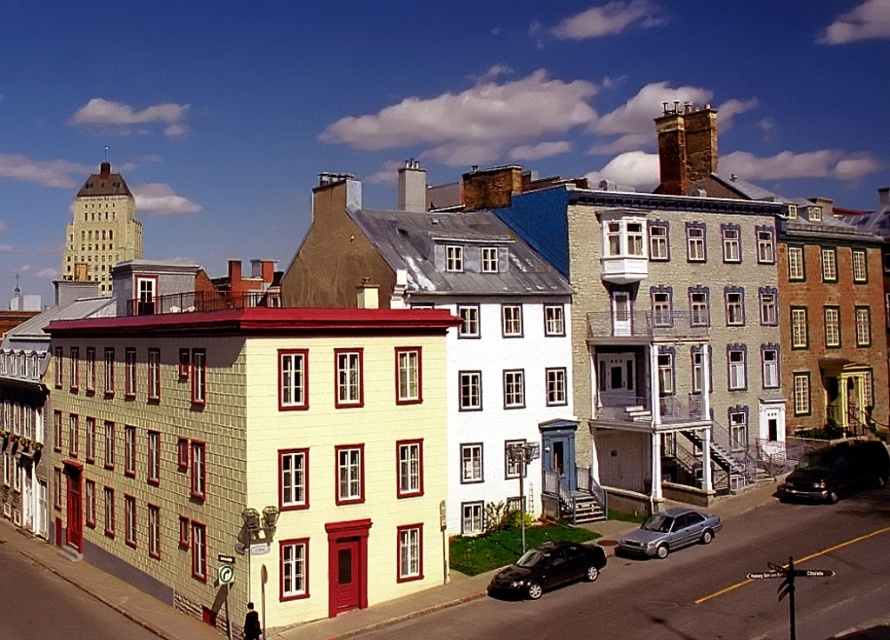
You are a pedestrian standing at the crosswalk in the middle of the street. You see a shiny black van at lower right and a metallic silver sedan at center. Which vehicle is positioned to the right of the other?

The shiny black van at lower right is to the right of the metallic silver sedan at center.

You are standing at the center of the street looking forward. There is a shiny black van at lower right. Where is the shiny black van located in relation to the point at coordinates (x=836, y=472)?

The shiny black van at lower right is located at point (x=836, y=472).

You are a pedestrian standing at the crosswalk on the sidewalk. You need to cross the street to reach the light beige or cream building with red trim on the left. Which direction should you walk to avoid the shiny black sedan at lower center and metallic silver sedan at center?

You should walk to the left of the shiny black sedan at lower center since it is positioned to the left of the metallic silver sedan at center, allowing you to safely reach the light beige or cream building with red trim on the left.